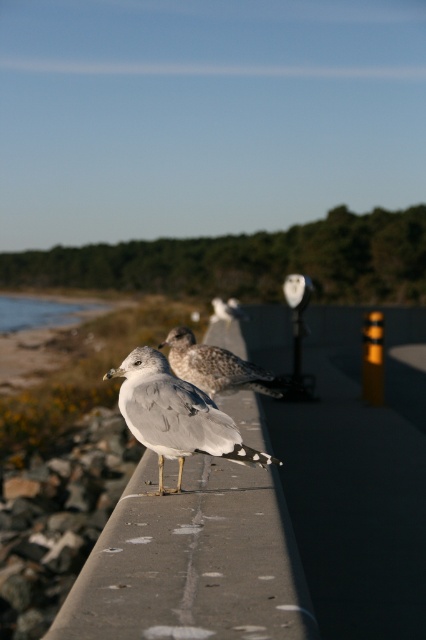
Can you confirm if gray feathered seagull at center is shorter than speckled feathered seagull at center?

Incorrect, gray feathered seagull at center's height does not fall short of speckled feathered seagull at center's.

Can you confirm if gray feathered seagull at center is thinner than speckled feathered seagull at center?

Yes, gray feathered seagull at center is thinner than speckled feathered seagull at center.

Is point (198, 419) farther from viewer compared to point (213, 353)?

No.

Find the location of a particular element. gray feathered seagull at center is located at coordinates (175, 416).